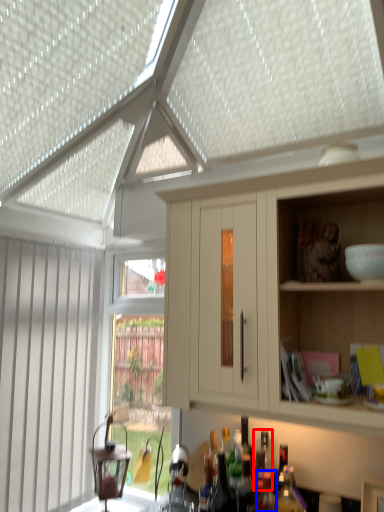
Question: Which of the following is the farthest to the observer, bottle (highlighted by a red box) or bottle (highlighted by a blue box)?

Choices:
 (A) bottle
 (B) bottle

Answer: (A)